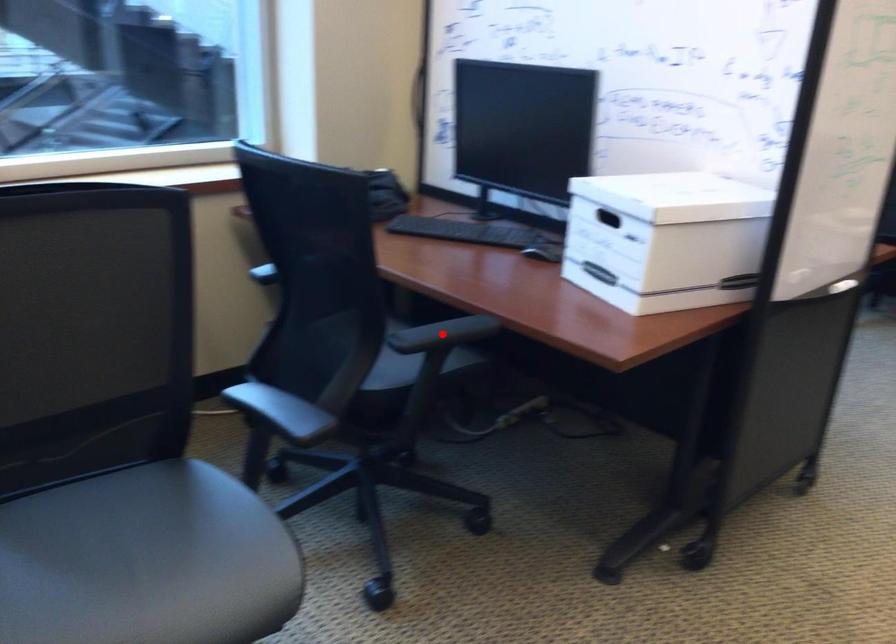
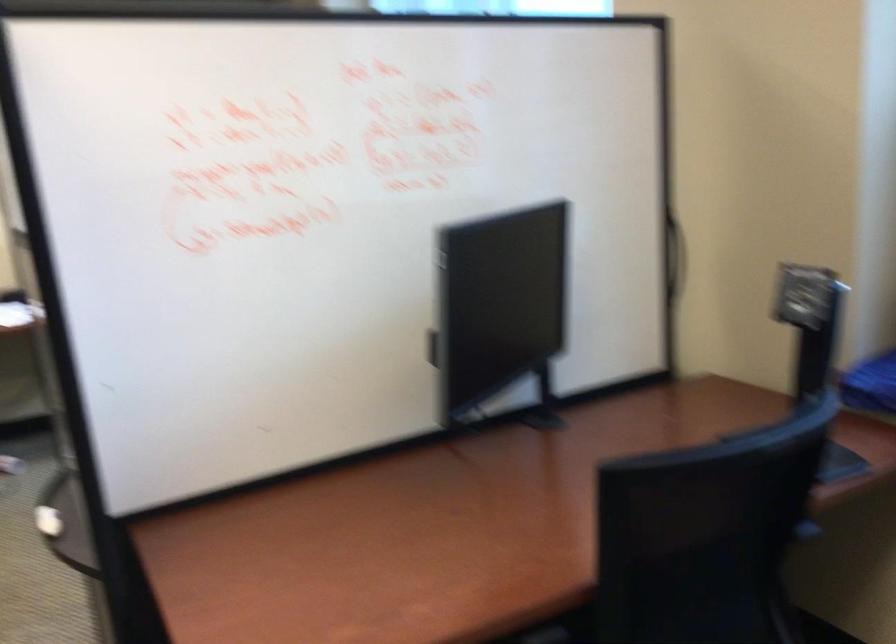
Question: I am providing you with two images of the same scene from different viewpoints. A red point is marked on the first image. At the location where the point appears in image 1, is it still visible in image 2?

Choices:
 (A) Yes
 (B) No

Answer: (B)